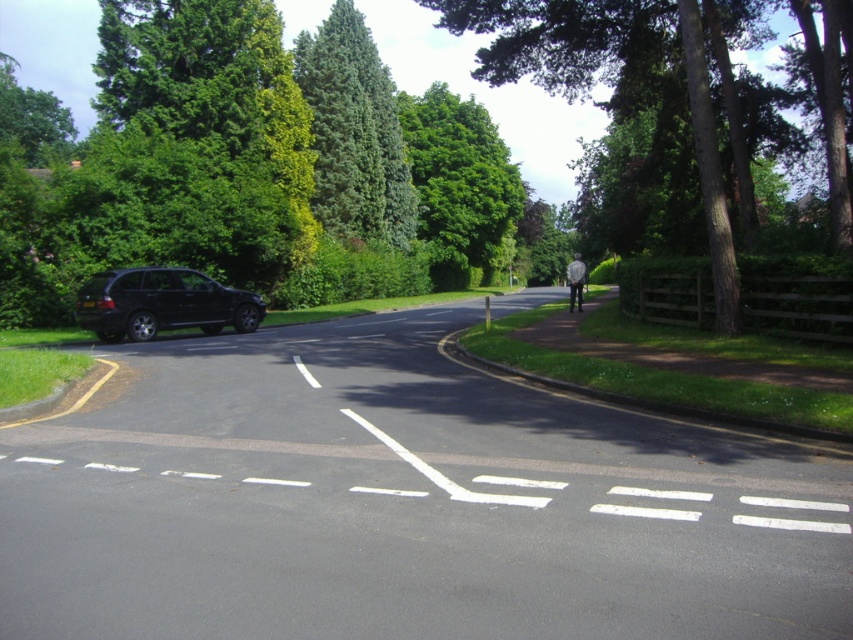
What do you see at coordinates (403, 502) in the screenshot?
I see `black car at left` at bounding box center [403, 502].

Between point (766, 573) and point (503, 12), which one is positioned in front?

Point (766, 573) is in front.

Where is `black car at left`? The width and height of the screenshot is (853, 640). black car at left is located at coordinates (403, 502).

Does black car at left appear under green coniferous tree at upper center?

Yes, black car at left is below green coniferous tree at upper center.

Is black car at left smaller than green coniferous tree at upper center?

Correct, black car at left occupies less space than green coniferous tree at upper center.

Between point (149, 534) and point (306, 92), which one is positioned in front?

Point (149, 534)

This screenshot has width=853, height=640. What are the coordinates of `black car at left` in the screenshot? It's located at (403, 502).

Who is higher up, green coniferous tree at upper center or shiny black suv at left?

green coniferous tree at upper center

From the picture: How much distance is there between green coniferous tree at upper center and shiny black suv at left?

green coniferous tree at upper center is 20.57 meters away from shiny black suv at left.

Between point (393, 154) and point (251, 296), which one is positioned behind?

Positioned behind is point (393, 154).

Find the location of `green coniferous tree at upper center`. green coniferous tree at upper center is located at coordinates (354, 132).